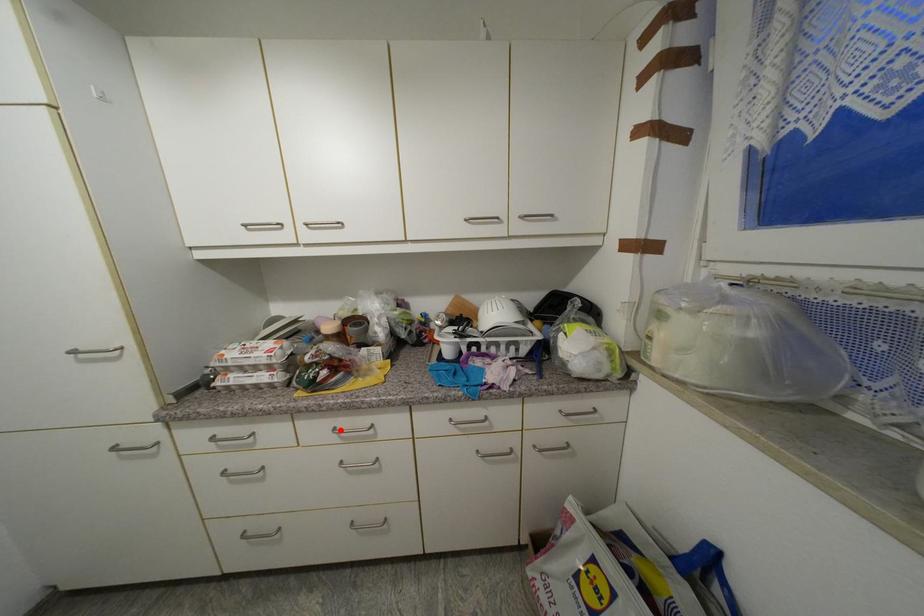
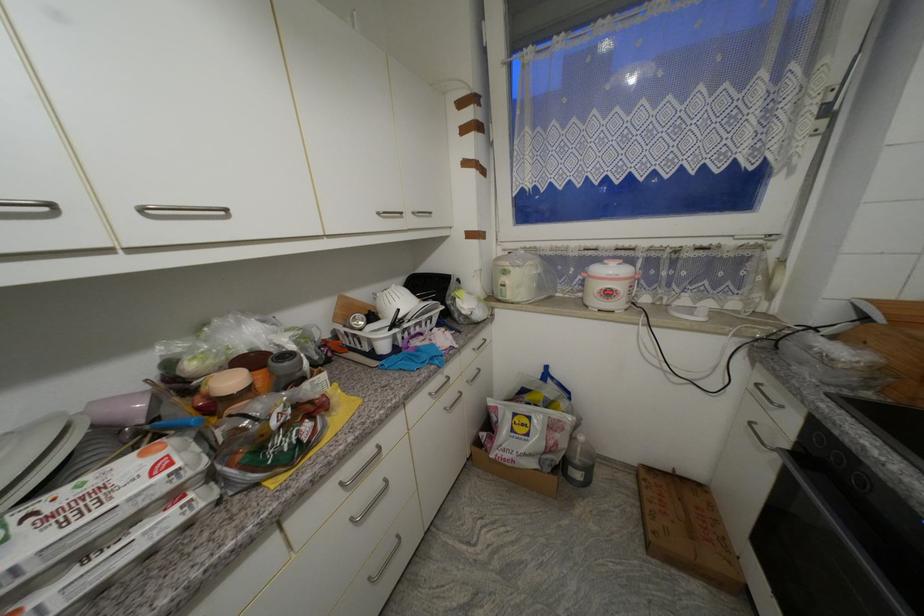
Question: I am providing you with two images of the same scene from different viewpoints. Given a red point in image1, look at the same physical point in image2. Is it:

Choices:
 (A) Closer to the viewpoint
 (B) Farther from the viewpoint

Answer: (A)